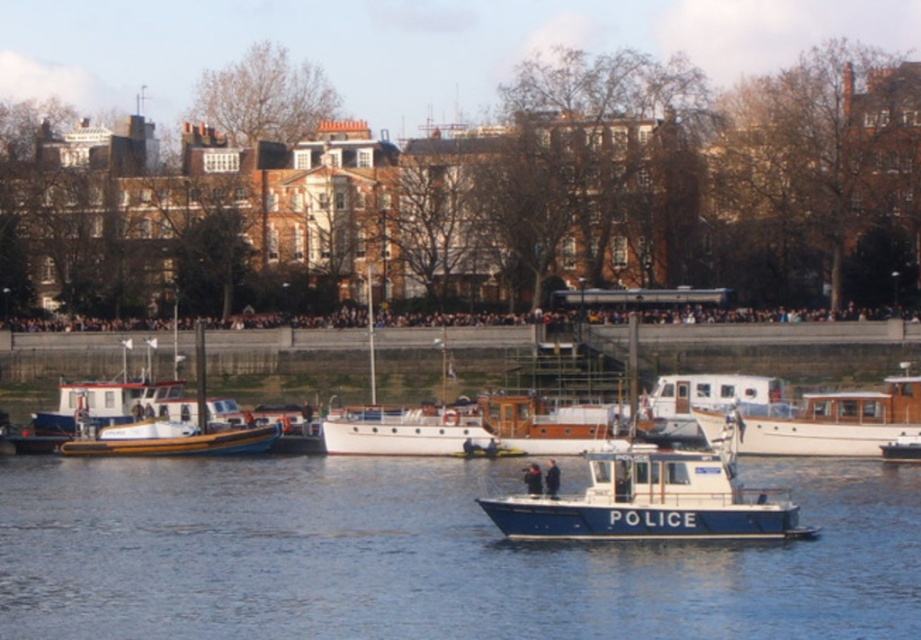
Consider the image. Who is lower down, blue polished wood police boat at center or white matte cabin cruiser at center?

blue polished wood police boat at center

Does point (675, 534) come closer to viewer compared to point (708, 392)?

Yes, it is.

Which is in front, point (531, 536) or point (706, 376)?

Point (531, 536) is more forward.

The image size is (921, 640). I want to click on blue polished wood police boat at center, so click(655, 500).

Does point (554, 522) come farther from viewer compared to point (341, 428)?

No, it is not.

The image size is (921, 640). What do you see at coordinates (655, 500) in the screenshot?
I see `blue polished wood police boat at center` at bounding box center [655, 500].

Locate an element on the screen. blue polished wood police boat at center is located at coordinates (655, 500).

Can you confirm if blue polished water at center is wider than wooden polished cabin cruiser at center?

Indeed, blue polished water at center has a greater width compared to wooden polished cabin cruiser at center.

What do you see at coordinates (426, 556) in the screenshot?
I see `blue polished water at center` at bounding box center [426, 556].

Is point (340, 616) in front of point (457, 412)?

Yes, it is in front of point (457, 412).

Find the location of a particular element. This screenshot has width=921, height=640. blue polished water at center is located at coordinates (426, 556).